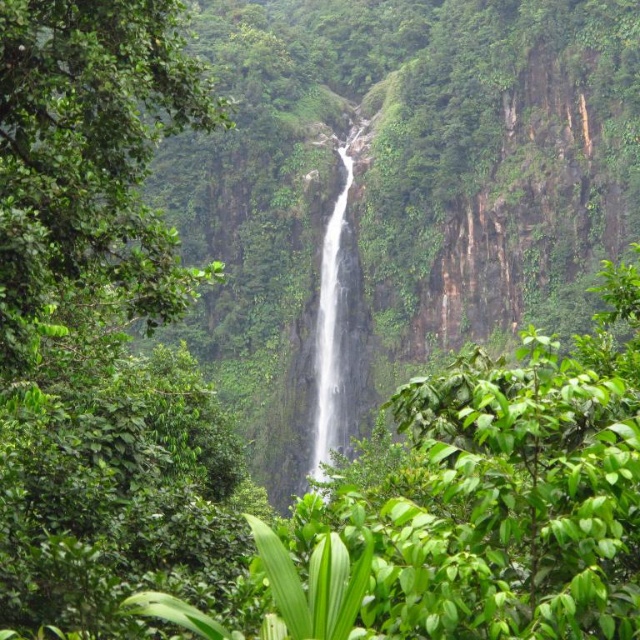
You are standing at the center of the image and want to locate the green leafy tree at center. Which direction should you look to find it?

The green leafy tree at center is located at point coordinates of (90, 161). Since you are at the center of the image, you should look slightly to the left and downward to locate the green leafy tree at center.

You are standing at the base of the waterfall in the image. There is a green leafy tree at center marked by point (90,161). If you want to walk directly towards that point, which direction should you head?

The green leafy tree at center is located at point (90,161), so you should head towards the center of the scene to reach it.

You are a hiker standing at the base of the green leafy tree at center and the white smooth waterfall at center. Which object is taller?

The green leafy tree at center has a lesser height compared to the white smooth waterfall at center, so the white smooth waterfall at center is taller.